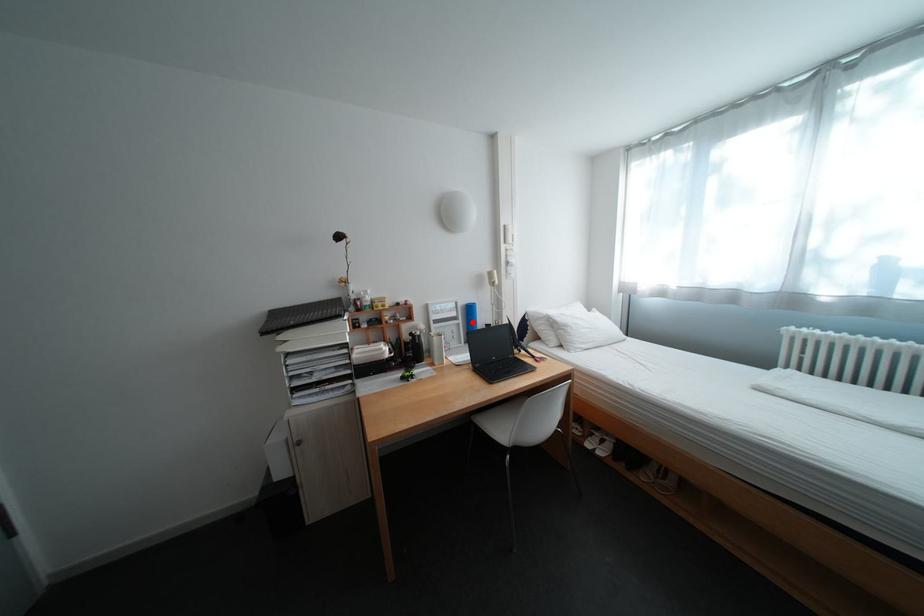
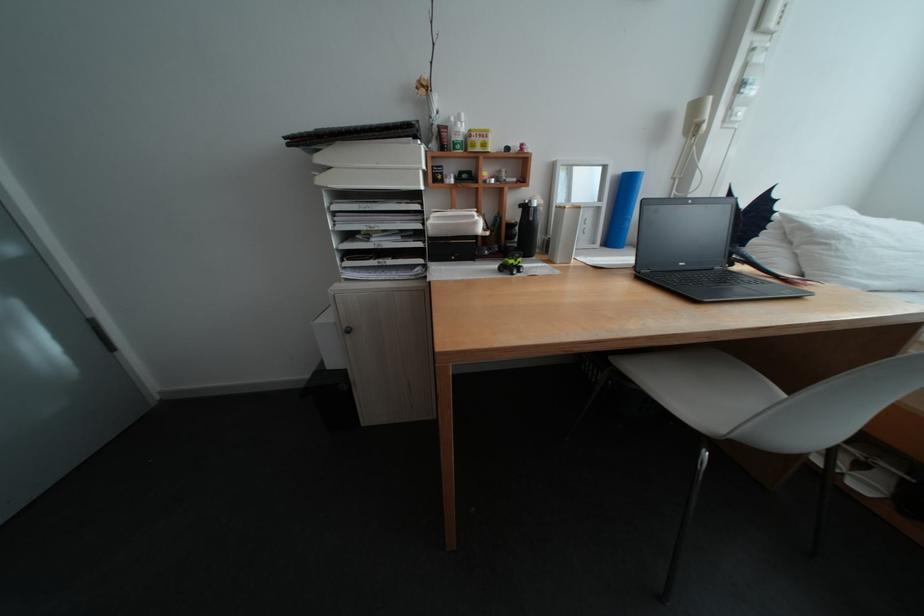
Question: I am providing you with two images of the same scene from different viewpoints. A red point is marked on the first image. At the location where the point appears in image 1, is it still visible in image 2?

Choices:
 (A) Yes
 (B) No

Answer: (A)